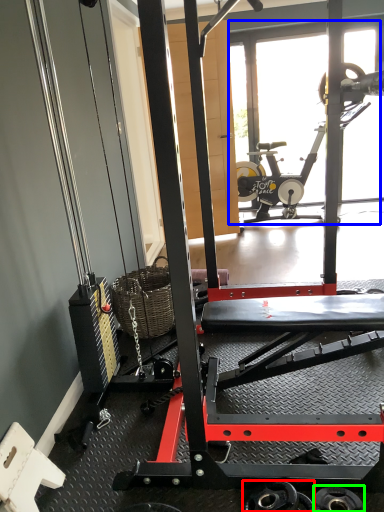
Question: Considering the real-world distances, which object is closest to wheel (highlighted by a red box)? glass door (highlighted by a blue box) or wheel (highlighted by a green box).

Choices:
 (A) glass door
 (B) wheel

Answer: (B)